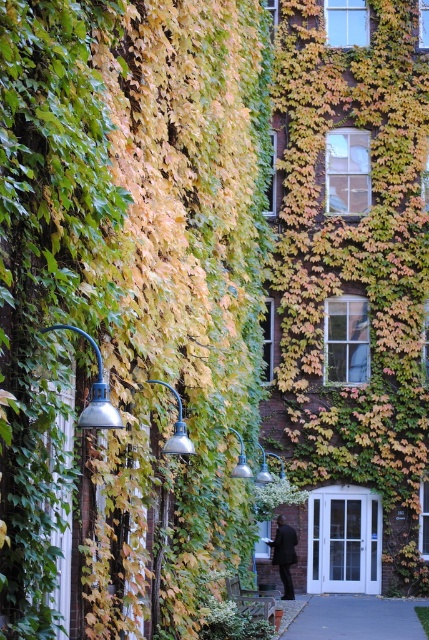
Question: Does gray concrete pavement at lower center appear on the right side of metallic blue lamp at left?

Choices:
 (A) yes
 (B) no

Answer: (A)

Question: Which object appears closest to the camera in this image?

Choices:
 (A) metallic blue lamp at left
 (B) satin silver lamp at center
 (C) gray concrete pavement at lower center
 (D) green leafy plant at center

Answer: (A)

Question: Among these points, which one is farthest from the camera?

Choices:
 (A) (362, 611)
 (B) (236, 474)
 (C) (97, 380)
 (D) (174, 449)

Answer: (A)

Question: Does matte silver lamp at center lie in front of satin silver lamp at center?

Choices:
 (A) yes
 (B) no

Answer: (A)

Question: Which is farther from the gray concrete pavement at lower center?

Choices:
 (A) matte silver lamp at center
 (B) metallic blue lamp at left

Answer: (B)

Question: Where is metallic blue lamp at left located in relation to satin silver lamp at center in the image?

Choices:
 (A) above
 (B) below

Answer: (A)